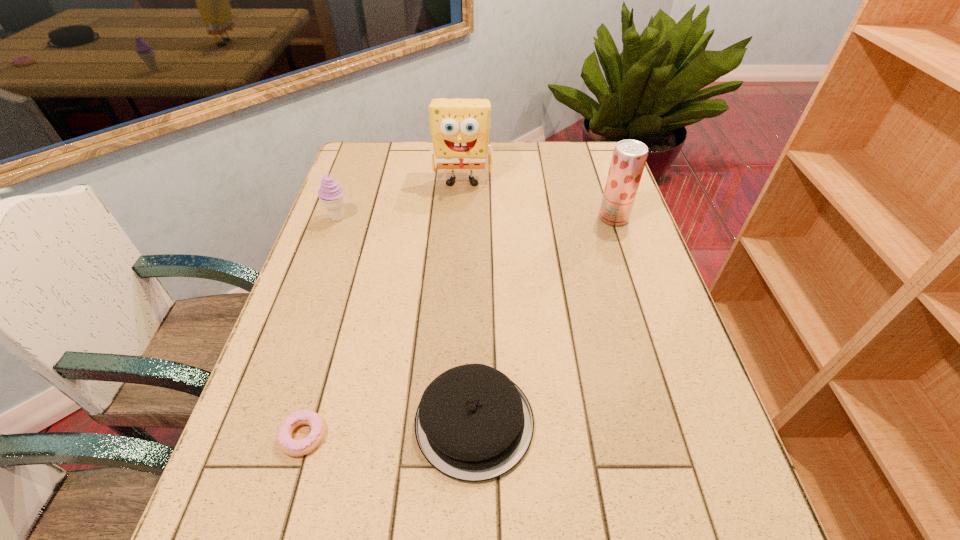
At what (x,y) coordinates should I click in order to perform the action: click on free space located on the back of the second shortest object. Please return your answer as a coordinate pair (x, y). The image size is (960, 540). Looking at the image, I should click on (475, 326).

You are a GUI agent. You are given a task and a screenshot of the screen. Output one action in this format:
    pyautogui.click(x=<x>, y=<y>)
    Task: Click on the vacant area situated 0.110m on the front of the second object from left to right
    This screenshot has height=540, width=960.
    Given the screenshot: What is the action you would take?
    pyautogui.click(x=277, y=525)

Where is `object located at the far edge`? The height and width of the screenshot is (540, 960). object located at the far edge is located at coordinates (459, 128).

This screenshot has width=960, height=540. I want to click on icecream positioned at the left edge, so click(330, 193).

What are the coordinates of `doughnut situated at the left edge` in the screenshot? It's located at (291, 447).

This screenshot has height=540, width=960. Find the location of `object located at the right edge`. object located at the right edge is located at coordinates (629, 157).

This screenshot has height=540, width=960. I want to click on vacant space at the far edge of the desktop, so click(x=509, y=152).

I want to click on vacant area at the near edge of the desktop, so click(393, 523).

Identify the location of vacant space at the left edge of the desktop. This screenshot has height=540, width=960. (292, 399).

Locate an element on the screen. Image resolution: width=960 pixels, height=540 pixels. blank space at the right edge of the desktop is located at coordinates (618, 304).